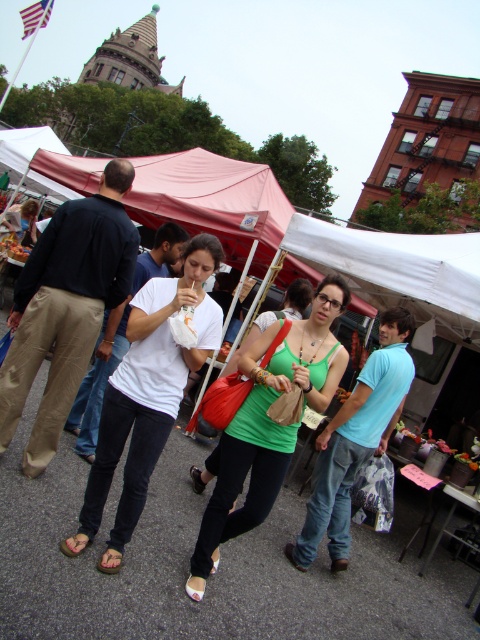
You are a vendor at the market and need to decide which item to place on a small shelf. Which object from the scene, the white fabric canopy at center or the brown leather sandal at lower left, would you choose based on size?

The brown leather sandal at lower left is smaller in size than the white fabric canopy at center, so you should choose the brown leather sandal at lower left for the small shelf.